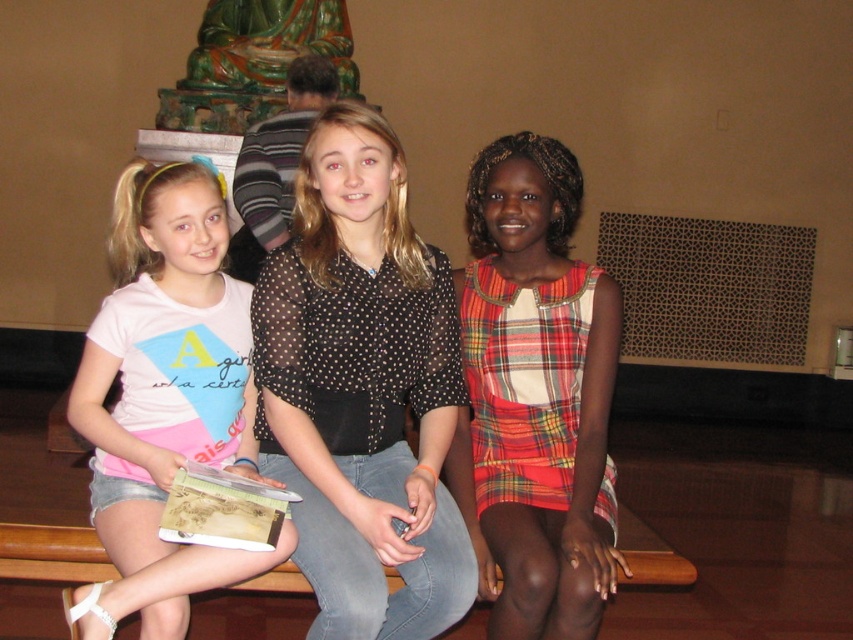
You are a fashion designer observing two outfits in the image. The outfits are the black sheer blouse at center and the plaid fabric dress at right. Which of these two outfits is bigger in size?

→ The black sheer blouse at center is larger in size than the plaid fabric dress at right.